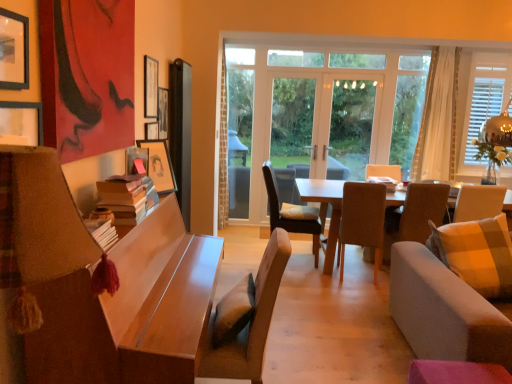
Question: From a real-world perspective, is light gray fabric couch at right located beneath light beige fabric chair at right, arranged as the fourth chair when viewed from the left?

Choices:
 (A) yes
 (B) no

Answer: (A)

Question: From the image's perspective, is light gray fabric couch at right below light beige fabric chair at right, arranged as the fourth chair when viewed from the left?

Choices:
 (A) no
 (B) yes

Answer: (B)

Question: Are light gray fabric couch at right and light beige fabric chair at right, the 1th chair when ordered from right to left, beside each other?

Choices:
 (A) yes
 (B) no

Answer: (B)

Question: Does light gray fabric couch at right come in front of light beige fabric chair at right, arranged as the fourth chair when viewed from the left?

Choices:
 (A) no
 (B) yes

Answer: (B)

Question: From the image's perspective, is light gray fabric couch at right on light beige fabric chair at right, arranged as the fourth chair when viewed from the left?

Choices:
 (A) no
 (B) yes

Answer: (A)

Question: Is light gray fabric couch at right smaller than light beige fabric chair at right, the third chair from the front?

Choices:
 (A) yes
 (B) no

Answer: (B)

Question: From a real-world perspective, is wooden picture frame at upper center, positioned as the fourth picture frame in front-to-back order, located higher than wooden table at center, the 1th table from the back?

Choices:
 (A) yes
 (B) no

Answer: (A)

Question: Would you consider wooden picture frame at upper center, which ranks as the 1th picture frame in back-to-front order, to be distant from wooden table at center, which is counted as the second table, starting from the left?

Choices:
 (A) yes
 (B) no

Answer: (A)

Question: Can you confirm if wooden picture frame at upper center, positioned as the fourth picture frame in front-to-back order, is thinner than wooden table at center, the 1th table from the back?

Choices:
 (A) yes
 (B) no

Answer: (A)

Question: Is wooden table at center, the 1th table from the back, surrounded by wooden picture frame at upper center, which ranks as the 1th picture frame in back-to-front order?

Choices:
 (A) no
 (B) yes

Answer: (A)

Question: Does wooden picture frame at upper center, which ranks as the 1th picture frame in back-to-front order, have a lesser height compared to wooden table at center, which is counted as the second table, starting from the left?

Choices:
 (A) no
 (B) yes

Answer: (B)

Question: From the image's perspective, is wooden picture frame at upper center, positioned as the fourth picture frame in front-to-back order, under wooden table at center, which is counted as the second table, starting from the left?

Choices:
 (A) no
 (B) yes

Answer: (A)

Question: Does white sheer curtain at right have a greater height compared to wooden picture frame at upper center, which ranks as the 1th picture frame in back-to-front order?

Choices:
 (A) no
 (B) yes

Answer: (B)